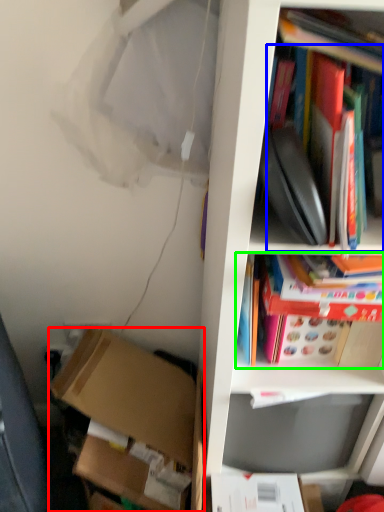
Question: Based on their relative distances, which object is nearer to box (highlighted by a red box)? Choose from book (highlighted by a blue box) and book (highlighted by a green box).

Choices:
 (A) book
 (B) book

Answer: (B)